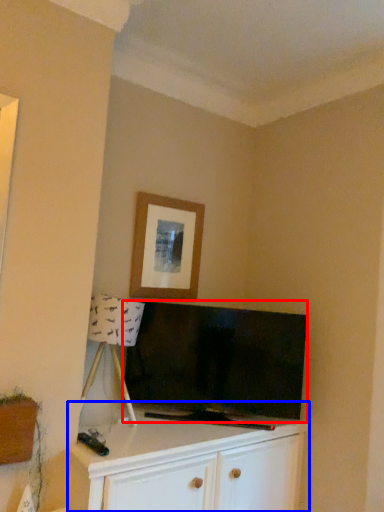
Question: Which point is further to the camera, television (highlighted by a red box) or cabinetry (highlighted by a blue box)?

Choices:
 (A) television
 (B) cabinetry

Answer: (A)